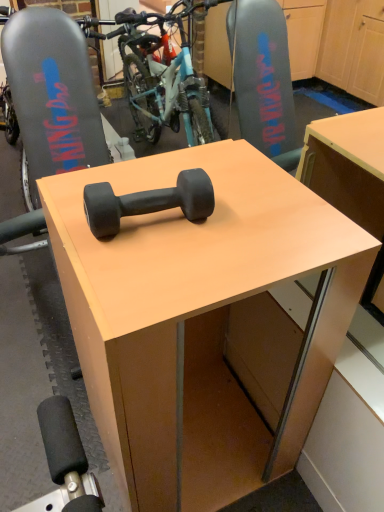
Where is `vacant point above matte black dumbbell at center (from a real-world perspective)`? vacant point above matte black dumbbell at center (from a real-world perspective) is located at coordinates (178, 222).